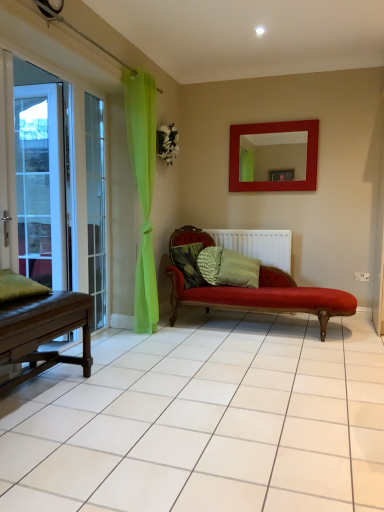
Where is `blank space situated above clear glass door at left (from a real-world perspective)`? blank space situated above clear glass door at left (from a real-world perspective) is located at coordinates (101, 88).